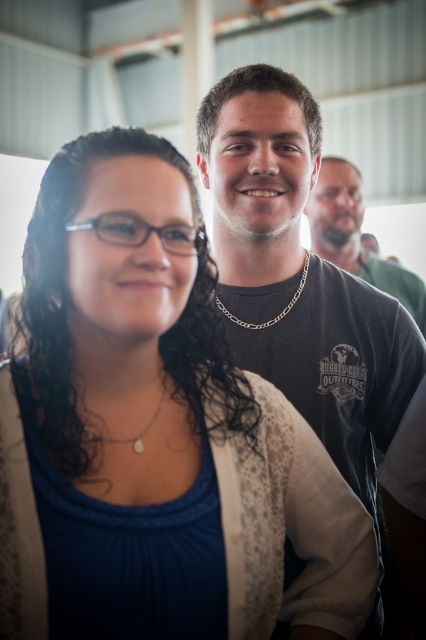
Is point (71, 406) in front of point (319, 241)?

Yes, point (71, 406) is closer to viewer.

Is matte white cardigan at center taller than matte black shirt at right?

No, matte white cardigan at center is not taller than matte black shirt at right.

The image size is (426, 640). What do you see at coordinates (157, 428) in the screenshot? I see `matte white cardigan at center` at bounding box center [157, 428].

Find the location of a particular element. The width and height of the screenshot is (426, 640). matte white cardigan at center is located at coordinates (157, 428).

Which of these two, matte white cardigan at center or pearl necklace at center, stands taller?

With more height is matte white cardigan at center.

Is matte white cardigan at center to the right of pearl necklace at center from the viewer's perspective?

Indeed, matte white cardigan at center is positioned on the right side of pearl necklace at center.

Who is more forward, [94,609] or [101,435]?

Point [94,609] is in front.

Where is `matte white cardigan at center`? The image size is (426, 640). matte white cardigan at center is located at coordinates (157, 428).

In the scene shown: Between matte white cardigan at center and dark gray t-shirt at center, which one appears on the right side from the viewer's perspective?

Positioned to the right is dark gray t-shirt at center.

Does matte white cardigan at center have a greater height compared to dark gray t-shirt at center?

No.

Who is more forward, [120,465] or [261,83]?

Point [120,465] is more forward.

You are a GUI agent. You are given a task and a screenshot of the screen. Output one action in this format:
    pyautogui.click(x=<x>, y=<y>)
    Task: Click on the matte white cardigan at center
    
    Given the screenshot: What is the action you would take?
    pyautogui.click(x=157, y=428)